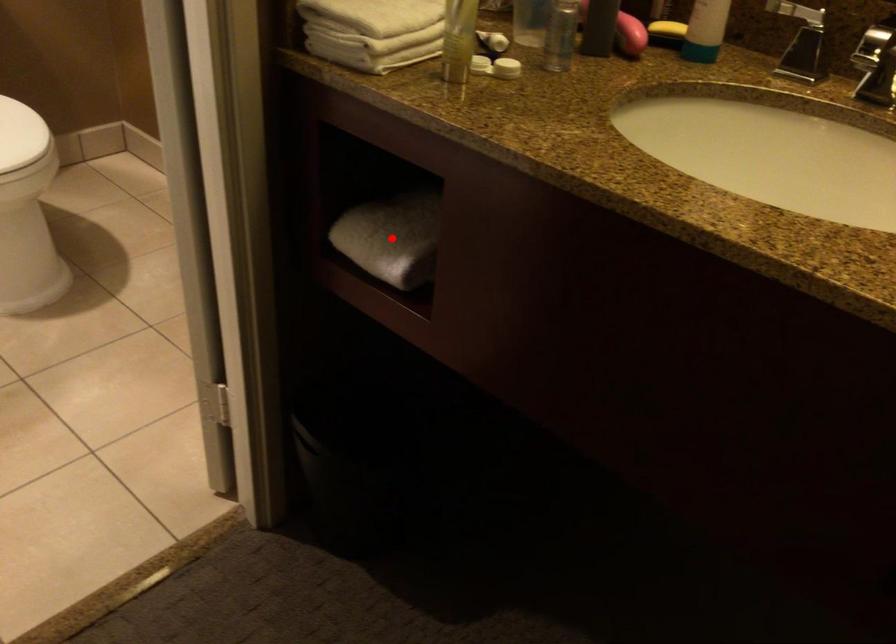
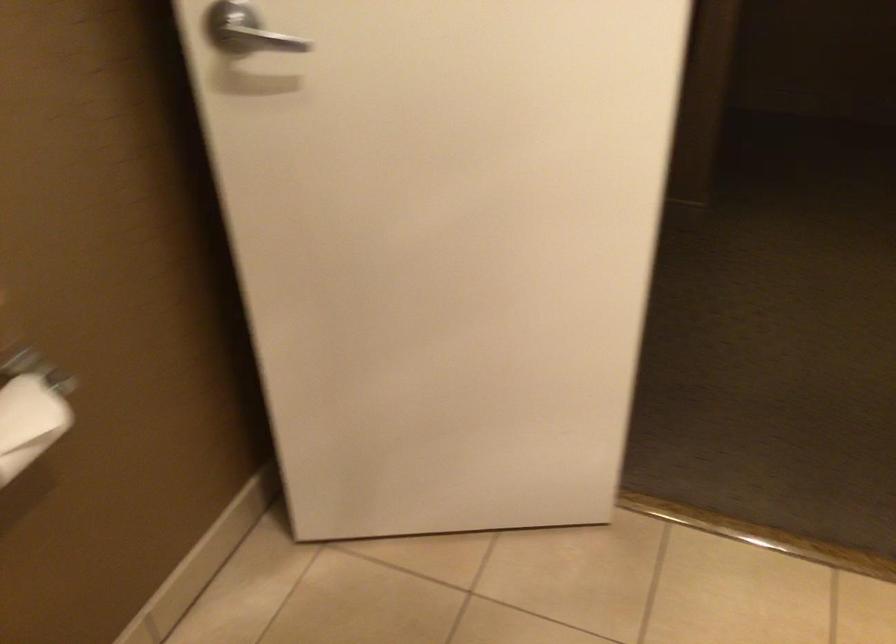
Question: I am providing you with two images of the same scene from different viewpoints. A red point is marked on the first image. At the location where the point appears in image 1, is it still visible in image 2?

Choices:
 (A) Yes
 (B) No

Answer: (B)